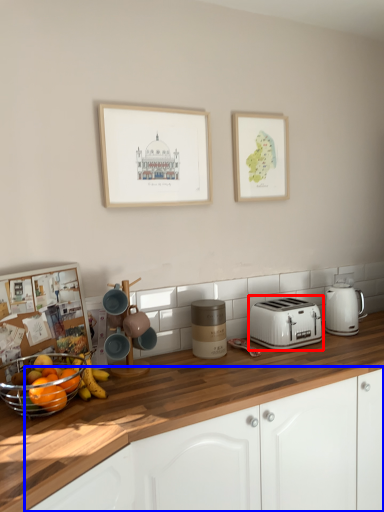
Question: Among these objects, which one is nearest to the camera, toaster (highlighted by a red box) or cabinetry (highlighted by a blue box)?

Choices:
 (A) toaster
 (B) cabinetry

Answer: (B)